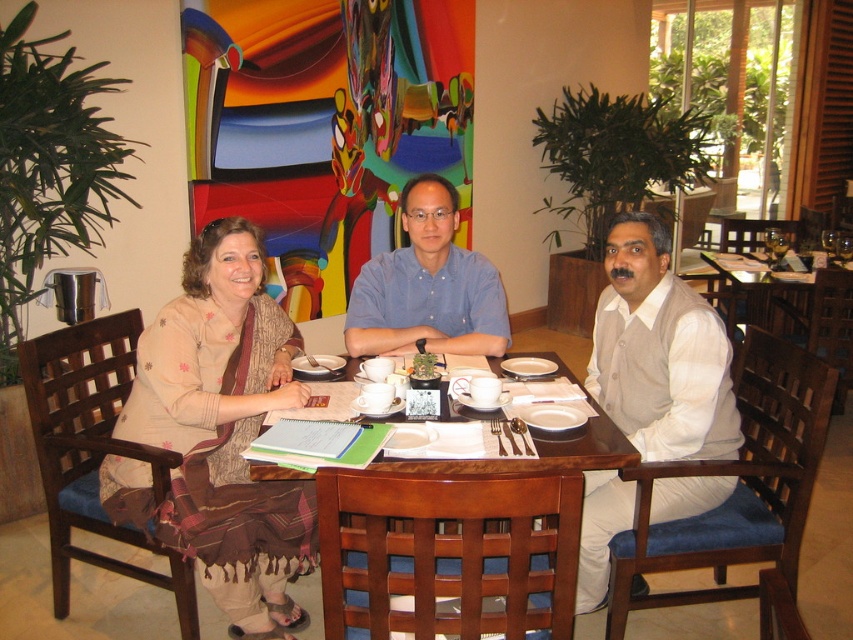
You are a waiter in a restaurant and need to place a new order of soup in a bowl next to the beige cotton shirt at center without spilling it. Considering the current arrangement, where should you place the soup bowl relative to the white glossy mug at center?

The beige cotton shirt at center is positioned under the white glossy mug at center, so to avoid spilling the soup, you should place the bowl next to the white glossy mug at center on the side opposite to where the beige cotton shirt at center is located.

Based on the photo, you are a photographer setting up for a group photo. You have a camera with a 1.5 meter wide lens view. The beige fabric saree at left and wooden table at center are both in your view. Can both objects fit within the camera view if the lens is adjusted to capture both?

The beige fabric saree at left has a smaller size compared to wooden table at center. Since the wooden table at center is larger, but the lens view is 1.5 meters wide, both objects can fit within the camera view as long as they are positioned within the 1.5 meter width.